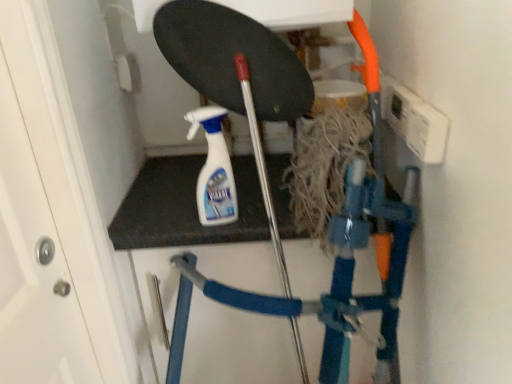
This screenshot has width=512, height=384. Find the location of `vacant area that is situated to the right of white plastic spray bottle at center`. vacant area that is situated to the right of white plastic spray bottle at center is located at coordinates (265, 217).